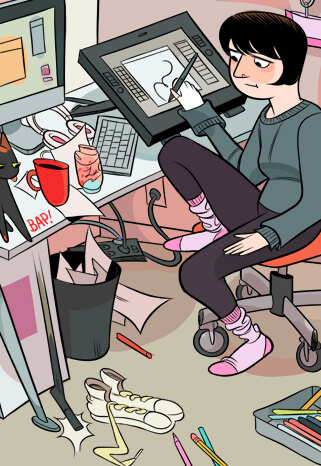
The image size is (321, 466). Find the location of `desk chair`. desk chair is located at coordinates (294, 259).